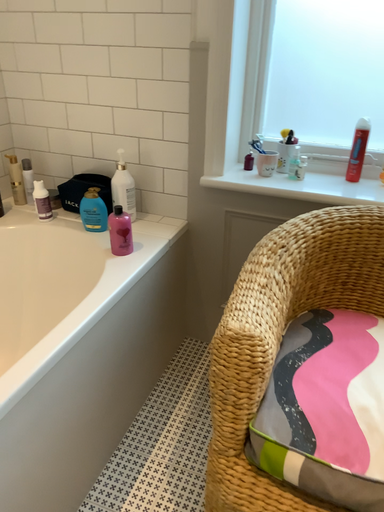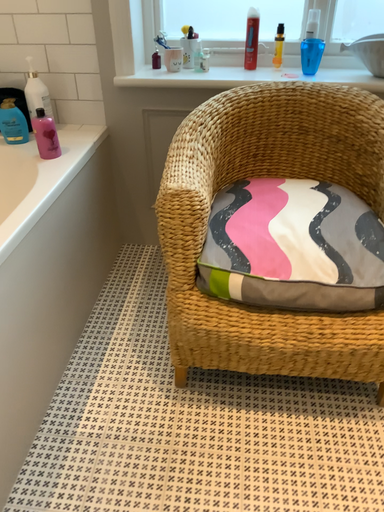
Question: Which way did the camera rotate in the video?

Choices:
 (A) rotated upward
 (B) rotated downward

Answer: (B)